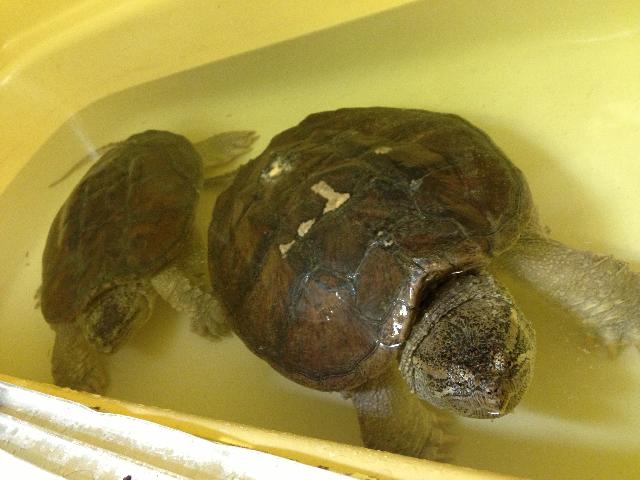
I want to click on left front leg, so click(x=592, y=300), click(x=208, y=308).